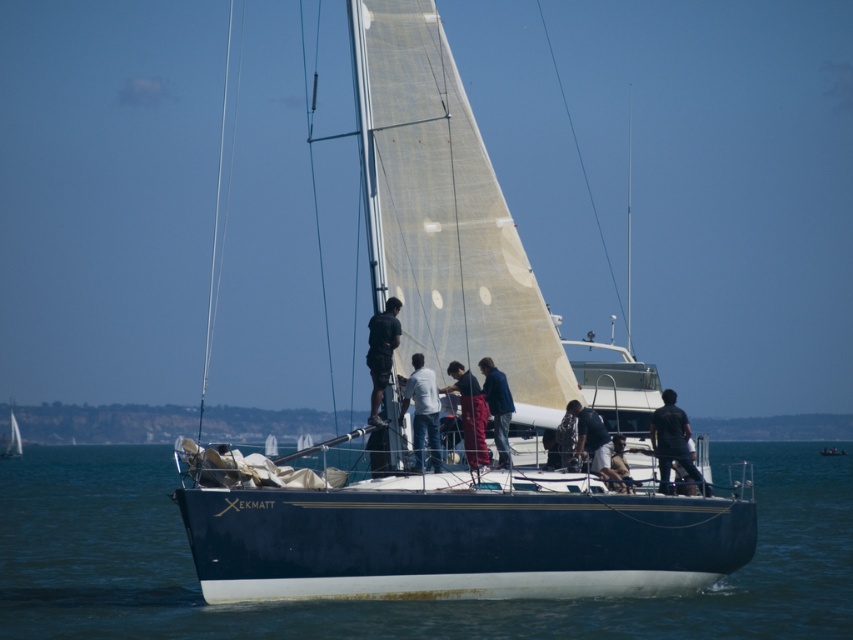
You are a photographer on the deck of the sailboat named X EKMATT. You want to take a photo that includes both the point at coordinates (438, 436) and the point at (450, 368). Since you know one of these points is closer to you, which point should you focus on first to ensure both points are in focus?

You should focus on the point at coordinates (438, 436) first because it is closer to you than the point at (450, 368). This way, both points will be in focus as the camera adjusts the depth of field.

You are a passenger on the sailboat named X EKMATT. You notice two items in your view. One is the blue water at center and the other is the black matte shirt at right. From your perspective on the boat, which item is positioned to the left?

The blue water at center is to the left of the black matte shirt at right, so the blue water at center is positioned to the left.